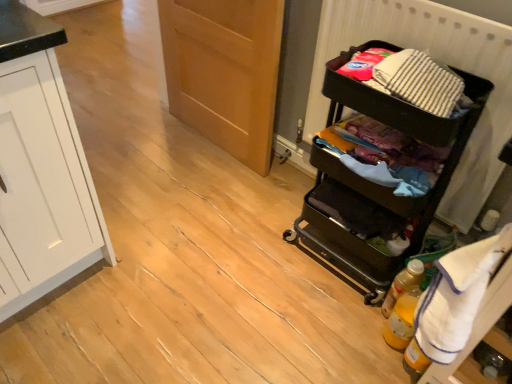
This screenshot has width=512, height=384. I want to click on free space to the left of translucent yellow bottle at lower right, the first bottle viewed from the back, so click(343, 305).